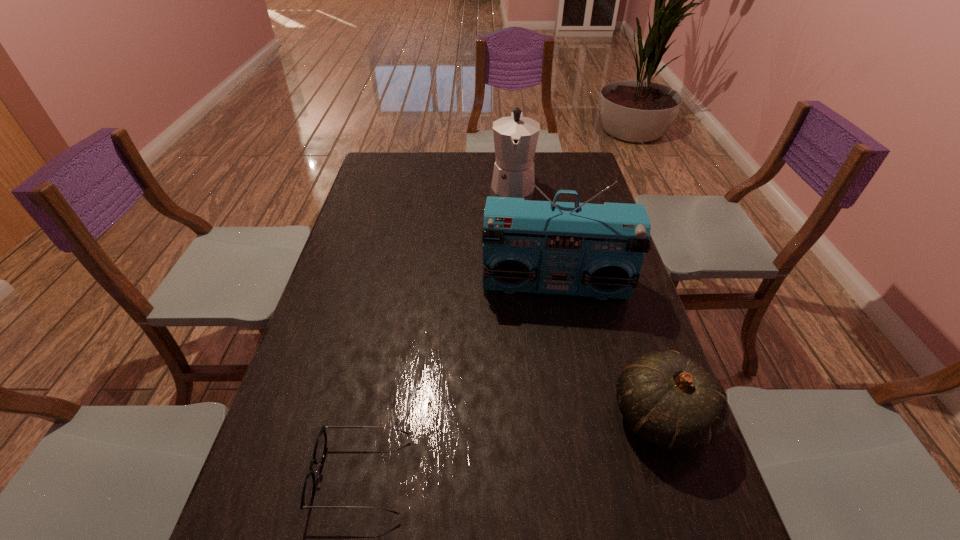
At what (x,y) coordinates should I click in order to perform the action: click on vacant spot on the desktop that is between the shortest object and the second shortest object and is positioned on the front-facing side of the second farthest object. Please return your answer as a coordinate pair (x, y). Looking at the image, I should click on (561, 437).

The width and height of the screenshot is (960, 540). I want to click on free space on the desktop that is between the shortest object and the gourd and is positioned at the spout of the farthest object, so click(x=501, y=449).